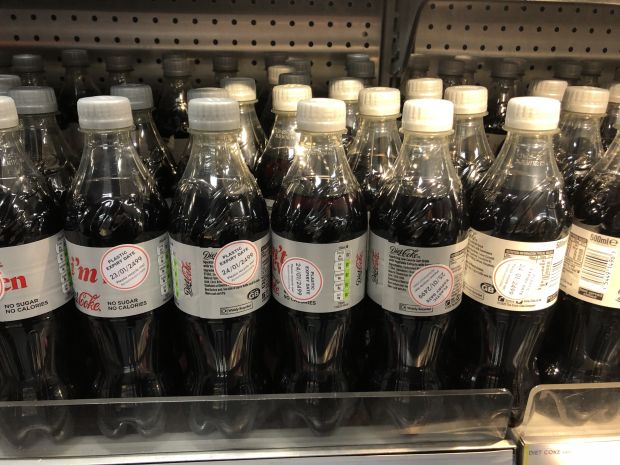
You are a GUI agent. You are given a task and a screenshot of the screen. Output one action in this format:
    pyautogui.click(x=<x>, y=<y>)
    Task: Click on the glass stopper
    
    Given the screenshot: What is the action you would take?
    pyautogui.click(x=355, y=425), pyautogui.click(x=555, y=419)